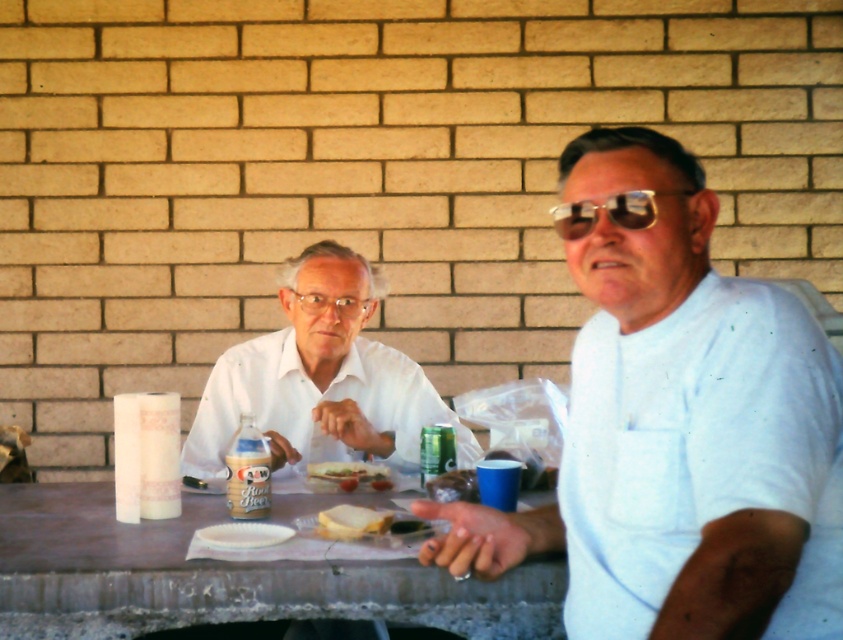
Between point (318, 520) and point (423, 483), which one is positioned in front?

Positioned in front is point (318, 520).

Between white bread at center and green metallic can at center, which one is positioned lower?

white bread at center is lower down.

This screenshot has height=640, width=843. What do you see at coordinates (352, 522) in the screenshot?
I see `white bread at center` at bounding box center [352, 522].

Find the location of a particular element. This screenshot has width=843, height=640. white bread at center is located at coordinates (352, 522).

Is white matte shirt at right thinner than white matte shirt at center?

Yes.

Does white matte shirt at right have a lesser height compared to white matte shirt at center?

No.

Describe the element at coordinates (678, 432) in the screenshot. I see `white matte shirt at right` at that location.

You are a GUI agent. You are given a task and a screenshot of the screen. Output one action in this format:
    pyautogui.click(x=<x>, y=<y>)
    Task: Click on the white matte shirt at right
    
    Given the screenshot: What is the action you would take?
    (678, 432)

Between point (255, 472) and point (350, 524), which one is positioned behind?

Positioned behind is point (255, 472).

Which of these two, translucent plastic bottle at center or white bread at center, stands taller?

Standing taller between the two is translucent plastic bottle at center.

Which is behind, point (262, 451) or point (331, 518)?

The point (262, 451) is behind.

In order to click on translucent plastic bottle at center in this screenshot , I will do `click(248, 472)`.